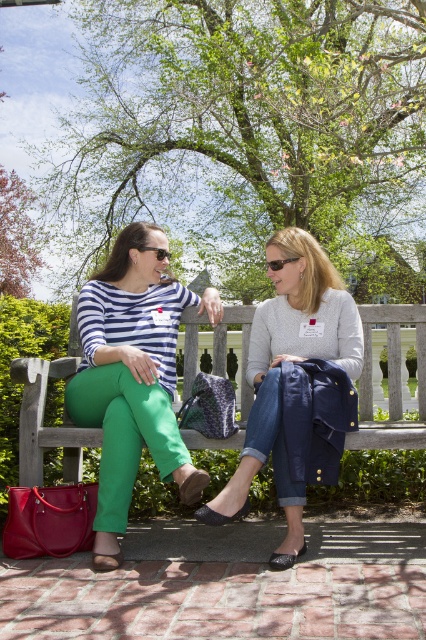
Question: From the image, what is the correct spatial relationship of matte striped shirt at center in relation to black plastic sunglasses at center?

Choices:
 (A) above
 (B) below

Answer: (B)

Question: Can you confirm if matte striped shirt at center is positioned below wooden bench at center?

Choices:
 (A) no
 (B) yes

Answer: (A)

Question: Which object is closer to the camera taking this photo?

Choices:
 (A) matte striped shirt at center
 (B) wooden bench at center
 (C) black plastic sunglasses at upper center

Answer: (A)

Question: Does matte striped shirt at center have a smaller size compared to black plastic sunglasses at center?

Choices:
 (A) yes
 (B) no

Answer: (B)

Question: Which of the following is the closest to the observer?

Choices:
 (A) (141, 248)
 (B) (319, 259)
 (C) (279, 266)

Answer: (C)

Question: Which object appears farthest from the camera in this image?

Choices:
 (A) denim jacket at center
 (B) black plastic sunglasses at upper center
 (C) wooden bench at center
 (D) matte striped shirt at center

Answer: (B)